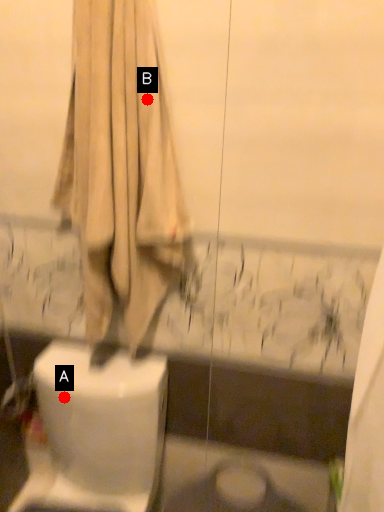
Question: Two points are circled on the image, labeled by A and B beside each circle. Which point is closer to the camera?

Choices:
 (A) A is closer
 (B) B is closer

Answer: (B)